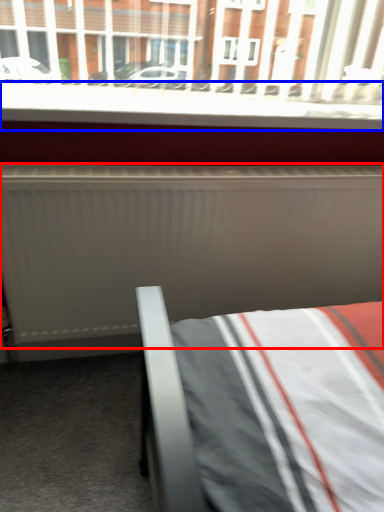
Question: Which object is closer to the camera taking this photo, radiator (highlighted by a red box) or window sill (highlighted by a blue box)?

Choices:
 (A) radiator
 (B) window sill

Answer: (A)